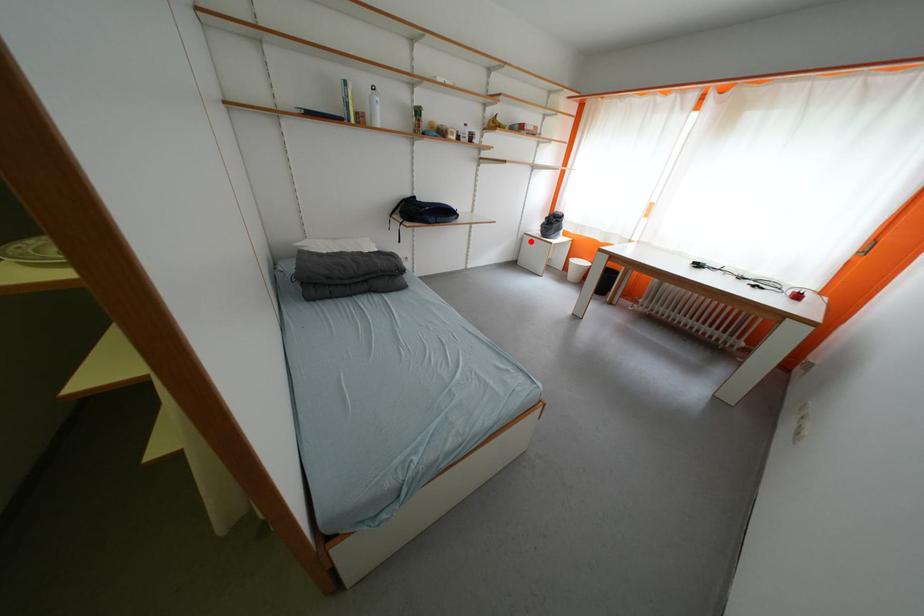
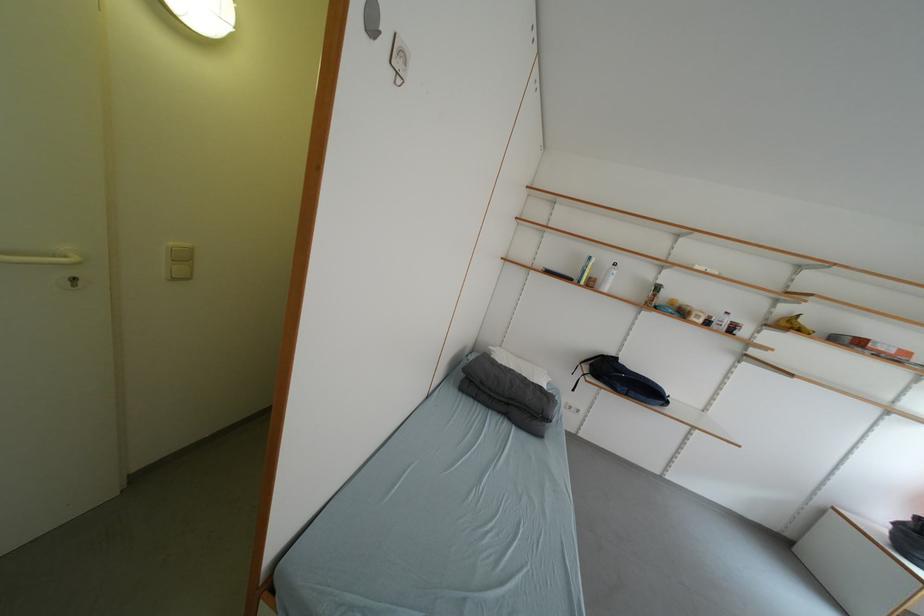
Question: A red point is marked in image1. In image2, is the corresponding 3D point closer to the camera or farther? Reply with the corresponding letter.

Choices:
 (A) The corresponding 3D point is closer.
 (B) The corresponding 3D point is farther.

Answer: (B)